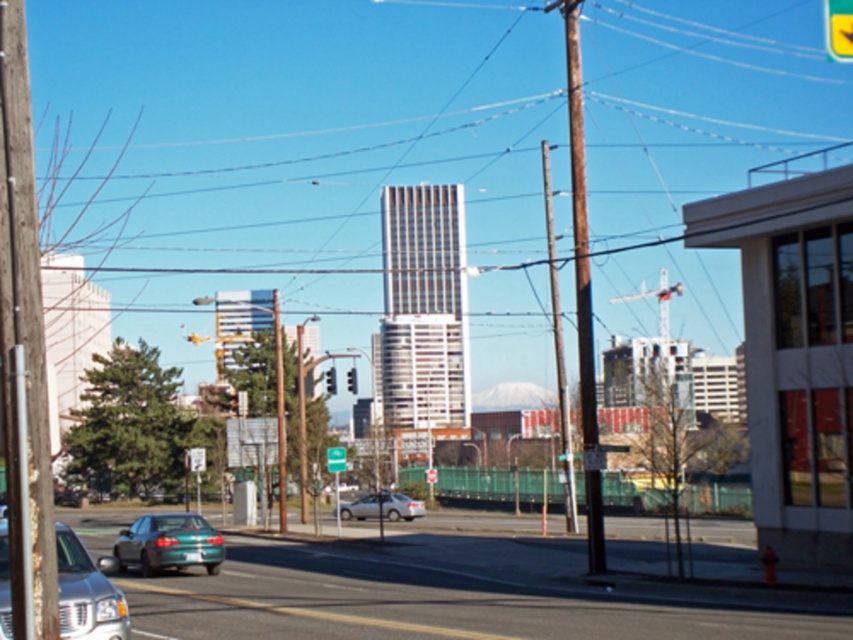
You are a city planner analyzing the urban layout. Based on the image, which object occupies a greater physical space in the scene between the brown wooden telegraph pole at center and the silver metallic sedan at lower left?

The brown wooden telegraph pole at center occupies a greater physical space in the scene compared to the silver metallic sedan at lower left as stated in the description.

You are standing on the sidewalk near the building with large windows and want to walk to the teal car driving away from you. There are two points marked on the road, one at coordinates point [592,438] and another at point [61,618]. Which point should you avoid stepping on to stay closer to the teal car?

You should avoid stepping on point [61,618] because point [592,438] is behind point [61,618], meaning it is closer to the teal car driving away from you.

You are a city planner assessing the safety of the urban street scene. You need to ensure that the brown wooden telegraph pole at center and the metallic traffic light at center comply with the city regulation that states they must be at least 10 meters apart. Based on the image, do they meet the requirement?

The brown wooden telegraph pole at center and metallic traffic light at center are 13.76 meters apart, which exceeds the minimum requirement of 10 meters. Therefore, they comply with the city regulation.